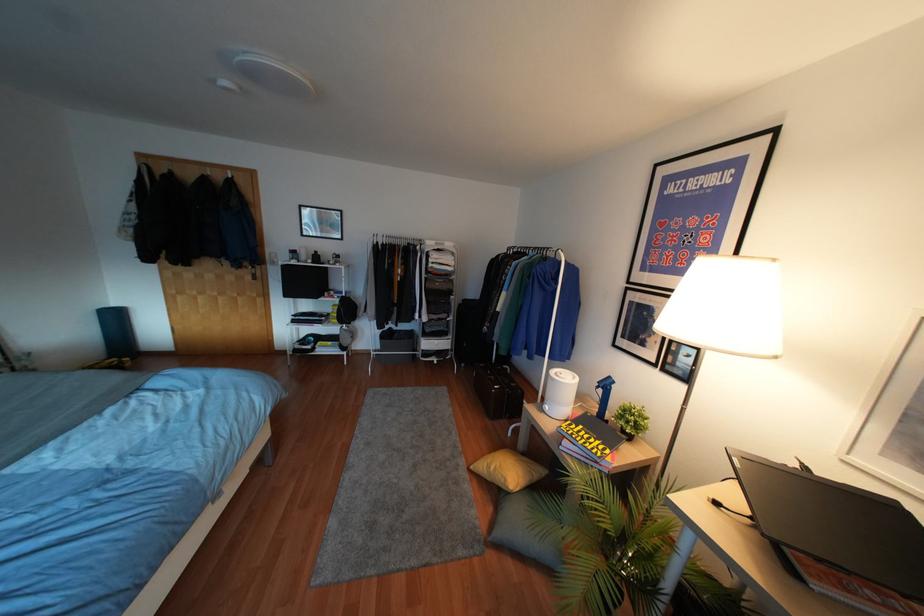
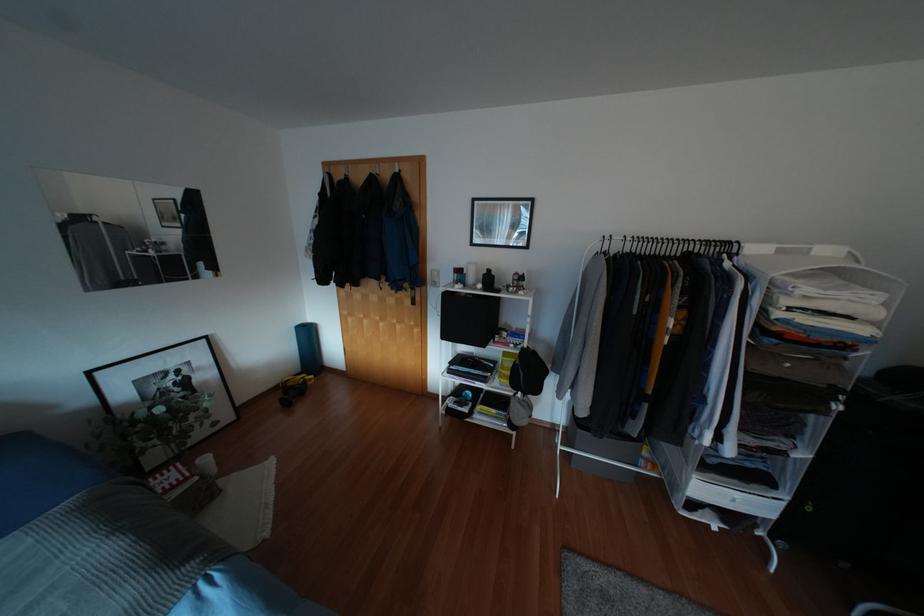
Locate, in the second image, the point that corresponds to [238,180] in the first image.

(406, 176)